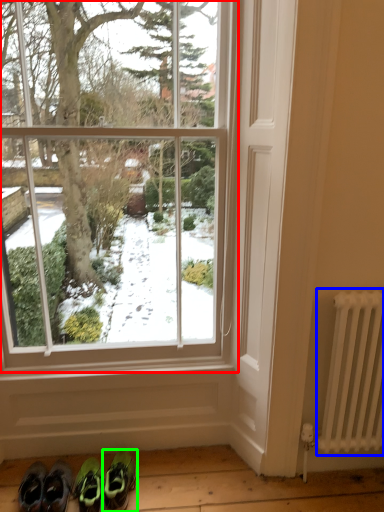
Question: Which object is positioned closest to window (highlighted by a red box)? Select from radiator (highlighted by a blue box) and footwear (highlighted by a green box).

Choices:
 (A) radiator
 (B) footwear

Answer: (A)